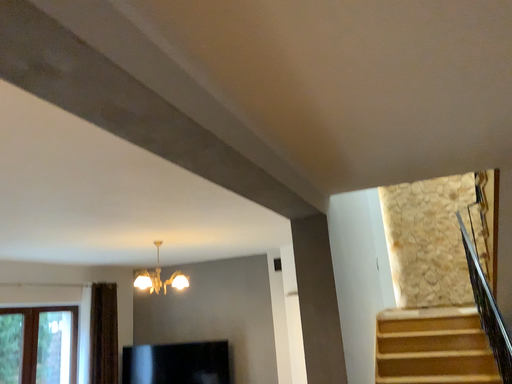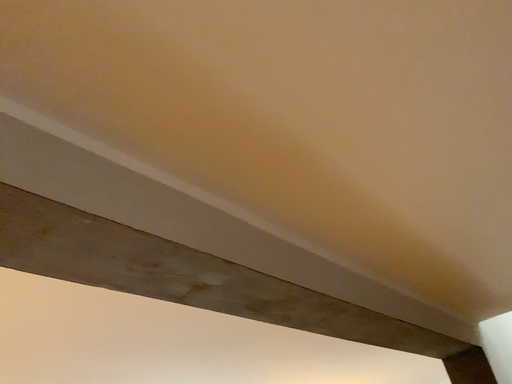
Question: How did the camera likely rotate when shooting the video?

Choices:
 (A) rotated right
 (B) rotated left

Answer: (B)